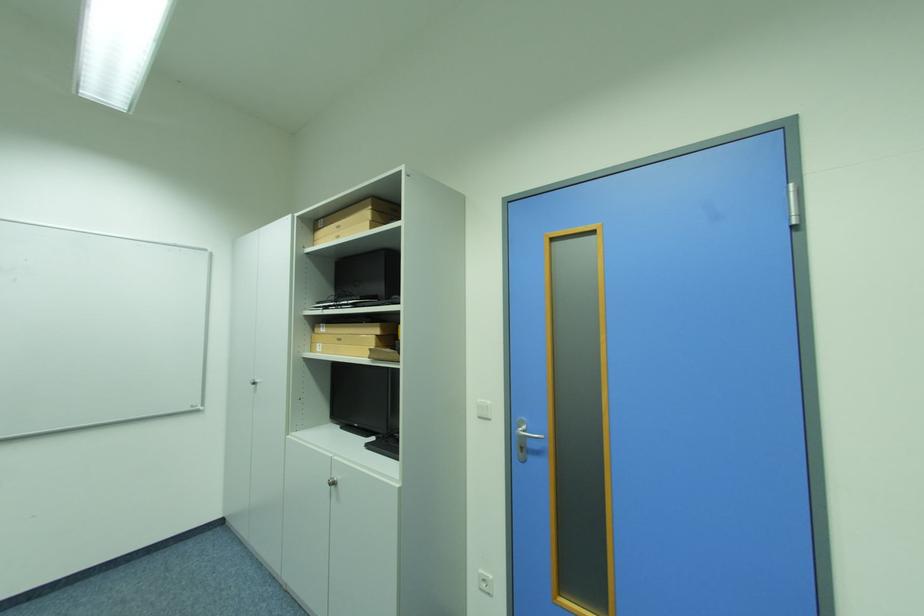
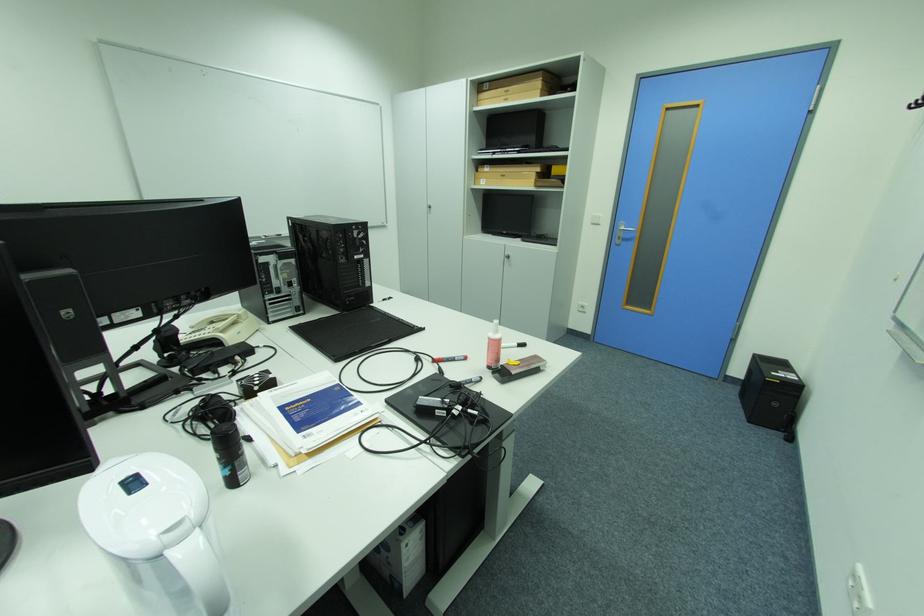
The point at (341, 484) is marked in the first image. Where is the corresponding point in the second image?

(516, 257)